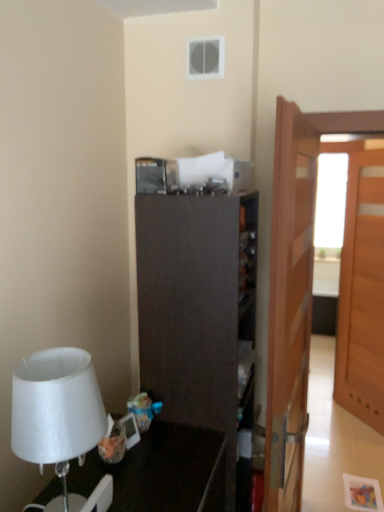
Question: Could you tell me if dark wood cabinet at center is facing white matte lampshade at left?

Choices:
 (A) no
 (B) yes

Answer: (A)

Question: From a real-world perspective, is dark wood cabinet at center positioned over white matte lampshade at left based on gravity?

Choices:
 (A) no
 (B) yes

Answer: (A)

Question: Would you say dark wood cabinet at center contains white matte lampshade at left?

Choices:
 (A) no
 (B) yes

Answer: (A)

Question: Is dark wood cabinet at center taller than white matte lampshade at left?

Choices:
 (A) yes
 (B) no

Answer: (A)

Question: From the image's perspective, would you say dark wood cabinet at center is positioned over white matte lampshade at left?

Choices:
 (A) yes
 (B) no

Answer: (B)

Question: Would you say wooden door at right, placed as the 1th door when sorted from front to back, is inside or outside white matte lampshade at left?

Choices:
 (A) outside
 (B) inside

Answer: (A)

Question: Looking at the image, does wooden door at right, placed as the 1th door when sorted from front to back, seem bigger or smaller compared to white matte lampshade at left?

Choices:
 (A) big
 (B) small

Answer: (A)

Question: From a real-world perspective, relative to white matte lampshade at left, is wooden door at right, which is the second door in right-to-left order, vertically above or below?

Choices:
 (A) above
 (B) below

Answer: (B)

Question: In terms of height, does wooden door at right, the 2th door from the back, look taller or shorter compared to white matte lampshade at left?

Choices:
 (A) tall
 (B) short

Answer: (A)

Question: From a real-world perspective, relative to white matte lampshade at left, is light brown wooden door at right, the 2th door in the left-to-right sequence, vertically above or below?

Choices:
 (A) above
 (B) below

Answer: (B)

Question: Is light brown wooden door at right, arranged as the 1th door when viewed from the right, in front of or behind white matte lampshade at left in the image?

Choices:
 (A) behind
 (B) front

Answer: (A)

Question: In terms of width, does light brown wooden door at right, arranged as the 1th door when viewed from the right, look wider or thinner when compared to white matte lampshade at left?

Choices:
 (A) thin
 (B) wide

Answer: (A)

Question: Visually, is light brown wooden door at right, the 2th door in the left-to-right sequence, positioned to the left or to the right of white matte lampshade at left?

Choices:
 (A) right
 (B) left

Answer: (A)

Question: Is point (314, 129) closer or farther from the camera than point (193, 273)?

Choices:
 (A) farther
 (B) closer

Answer: (A)

Question: From a real-world perspective, relative to dark wood cabinet at center, is wooden door at right, placed as the 1th door when sorted from front to back, vertically above or below?

Choices:
 (A) above
 (B) below

Answer: (A)